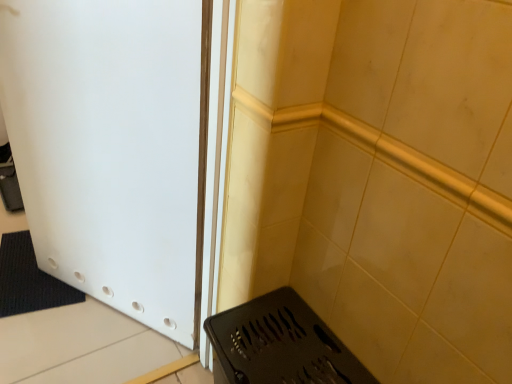
Question: From a real-world perspective, is black matte grill at lower right physically located above or below white matte door at left?

Choices:
 (A) below
 (B) above

Answer: (A)

Question: In the image, is black matte grill at lower right positioned in front of or behind white matte door at left?

Choices:
 (A) front
 (B) behind

Answer: (B)

Question: Considering the relative positions of black matte grill at lower right and white matte door at left in the image provided, is black matte grill at lower right to the left or to the right of white matte door at left?

Choices:
 (A) left
 (B) right

Answer: (B)

Question: Considering the relative positions of white matte door at left and black matte grill at lower right in the image provided, is white matte door at left to the left or to the right of black matte grill at lower right?

Choices:
 (A) right
 (B) left

Answer: (B)

Question: Is white matte door at left inside the boundaries of black matte grill at lower right, or outside?

Choices:
 (A) outside
 (B) inside

Answer: (A)

Question: Considering the positions of white matte door at left and black matte grill at lower right in the image, is white matte door at left bigger or smaller than black matte grill at lower right?

Choices:
 (A) big
 (B) small

Answer: (A)

Question: From the image's perspective, is white matte door at left positioned above or below black matte grill at lower right?

Choices:
 (A) below
 (B) above

Answer: (B)